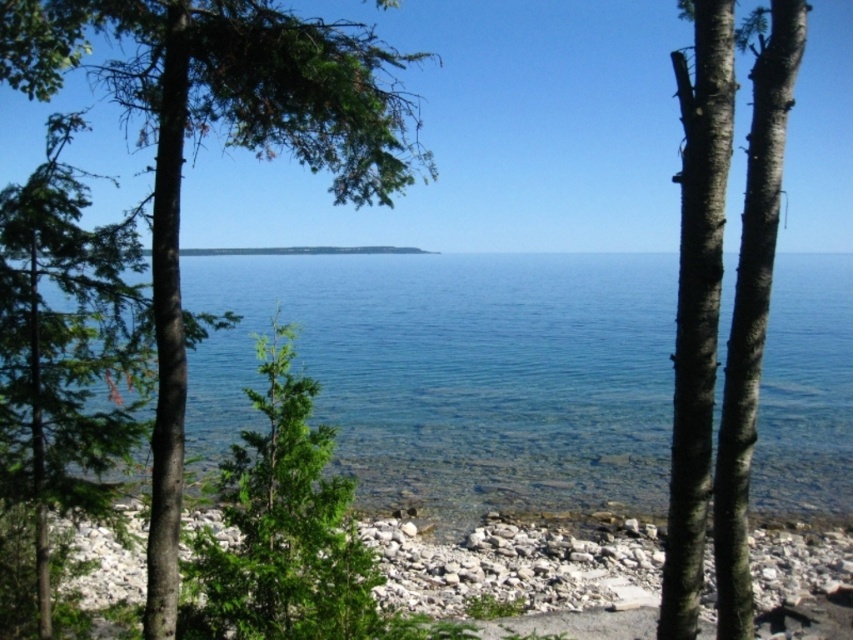
You are standing at the edge of the rocky shoreline and see the white pebbles at lower center and the smooth bark tree at right. Which object is closer to your right side?

The smooth bark tree at right is closer to your right side because it is positioned to the right of the white pebbles at lower center.

You are a hiker trying to decide which tree to sit under for shade. You see the green leafy tree at left and the smooth bark tree at right. Which tree provides more shade?

The green leafy tree at left provides more shade because it is bigger than the smooth bark tree at right.

You are standing at the point marked by the coordinates point (515, 566). What can you see directly beneath your feet?

You can see the white pebbles at lower center directly beneath your feet at point (515, 566).